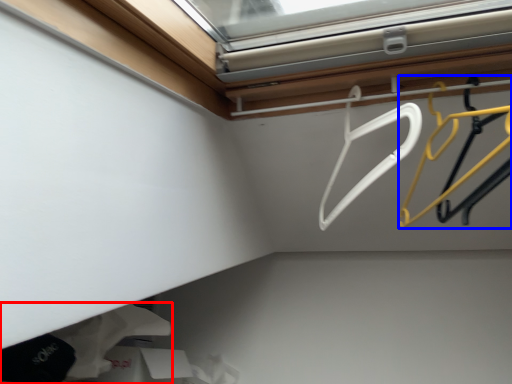
Question: Which point is closer to the camera, clothing (highlighted by a red box) or hanger (highlighted by a blue box)?

Choices:
 (A) clothing
 (B) hanger

Answer: (B)